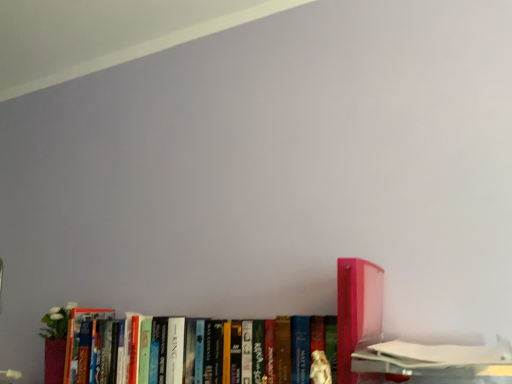
Question: Is pink plastic book at right, placed as the second book when sorted from left to right, oriented away from hardcover book at center, arranged as the first book when viewed from the left?

Choices:
 (A) yes
 (B) no

Answer: (B)

Question: Is the depth of pink plastic book at right, placed as the second book when sorted from left to right, less than that of hardcover book at center, arranged as the first book when viewed from the left?

Choices:
 (A) yes
 (B) no

Answer: (A)

Question: Can you confirm if pink plastic book at right, the second book positioned from the right, is thinner than hardcover book at center, marked as the third book in a right-to-left arrangement?

Choices:
 (A) no
 (B) yes

Answer: (A)

Question: Does pink plastic book at right, the second book positioned from the right, have a lesser height compared to hardcover book at center, marked as the third book in a right-to-left arrangement?

Choices:
 (A) yes
 (B) no

Answer: (B)

Question: Does pink plastic book at right, the second book positioned from the right, come behind hardcover book at center, marked as the third book in a right-to-left arrangement?

Choices:
 (A) yes
 (B) no

Answer: (B)

Question: Is pink plastic book at right, the second book positioned from the right, smaller than hardcover book at center, arranged as the first book when viewed from the left?

Choices:
 (A) yes
 (B) no

Answer: (A)

Question: Considering the relative positions of pink plastic book at right, the second book positioned from the right, and matte cardboard book at lower right, which is the 1th book from right to left, in the image provided, is pink plastic book at right, the second book positioned from the right, to the right of matte cardboard book at lower right, which is the 1th book from right to left, from the viewer's perspective?

Choices:
 (A) yes
 (B) no

Answer: (B)

Question: Is pink plastic book at right, the second book positioned from the right, bigger than matte cardboard book at lower right, which is the 1th book from right to left?

Choices:
 (A) yes
 (B) no

Answer: (B)

Question: Is pink plastic book at right, the second book positioned from the right, further to camera compared to matte cardboard book at lower right, which is the 1th book from right to left?

Choices:
 (A) yes
 (B) no

Answer: (A)

Question: Is pink plastic book at right, the second book positioned from the right, wider than matte cardboard book at lower right, which is the 1th book from right to left?

Choices:
 (A) no
 (B) yes

Answer: (A)

Question: Is pink plastic book at right, placed as the second book when sorted from left to right, beside matte cardboard book at lower right, which is the 3th book in left-to-right order?

Choices:
 (A) no
 (B) yes

Answer: (A)

Question: Is pink plastic book at right, the second book positioned from the right, positioned in front of matte cardboard book at lower right, which is the 3th book in left-to-right order?

Choices:
 (A) yes
 (B) no

Answer: (B)

Question: From a real-world perspective, is matte cardboard book at lower right, which is the 1th book from right to left, located beneath hardcover book at center, marked as the third book in a right-to-left arrangement?

Choices:
 (A) no
 (B) yes

Answer: (B)